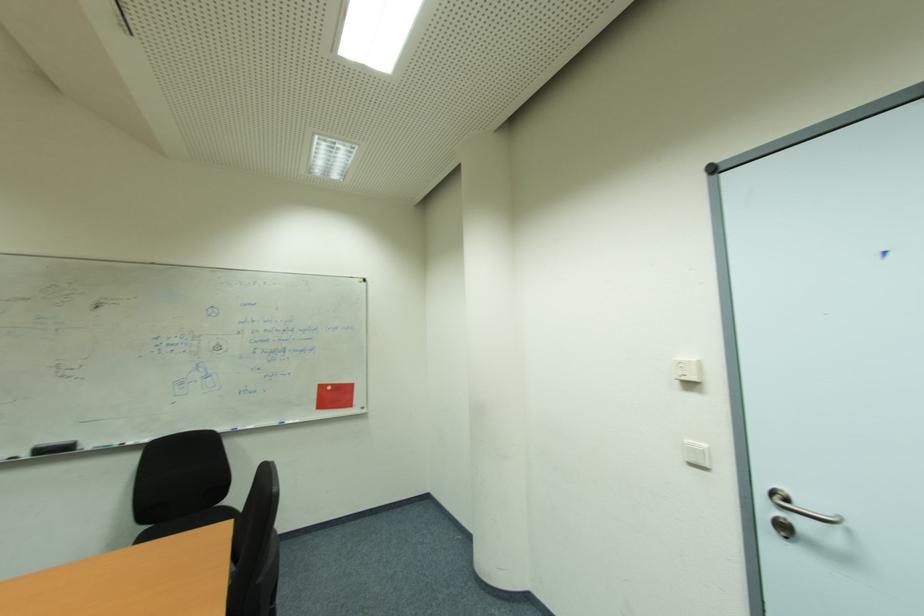
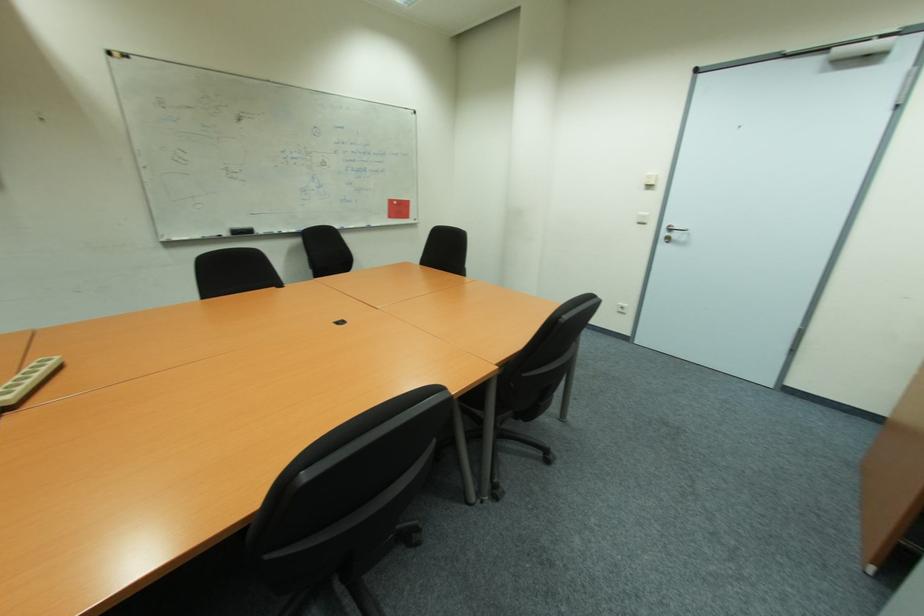
In a continuous first-person perspective shot, in which direction is the camera moving?

The movement direction of the cameraman is left, backward.